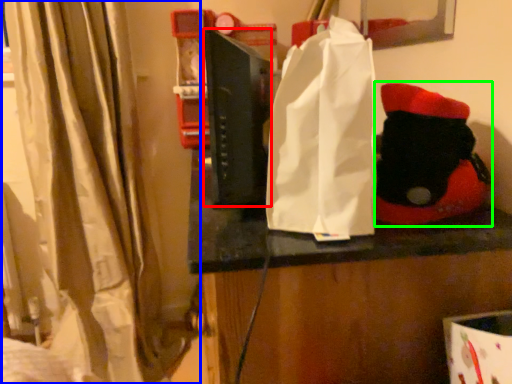
Question: Based on their relative distances, which object is nearer to book (highlighted by a red box)? Choose from curtain (highlighted by a blue box) and toy (highlighted by a green box).

Choices:
 (A) curtain
 (B) toy

Answer: (B)